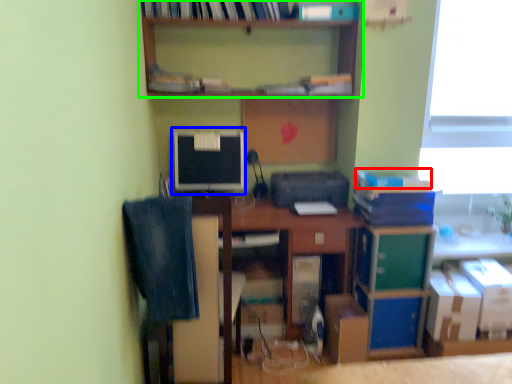
Question: Considering the real-world distances, which object is farthest from book (highlighted by a red box)? computer monitor (highlighted by a blue box) or shelf (highlighted by a green box)?

Choices:
 (A) computer monitor
 (B) shelf

Answer: (A)